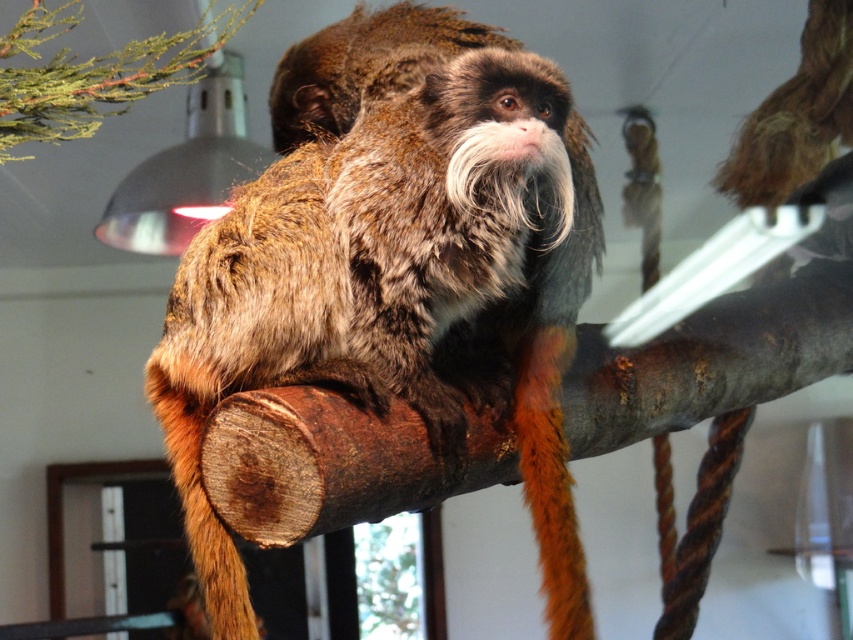
Question: Does brown furry monkey at center have a greater width compared to green leafy branch at upper left?

Choices:
 (A) no
 (B) yes

Answer: (B)

Question: Observing the image, what is the correct spatial positioning of brown furry monkey at center in reference to green leafy branch at upper left?

Choices:
 (A) left
 (B) right

Answer: (B)

Question: Which object appears closest to the camera in this image?

Choices:
 (A) green leafy branch at upper left
 (B) brown furry monkey at center

Answer: (B)

Question: Can you confirm if brown furry monkey at center is positioned to the right of green leafy branch at upper left?

Choices:
 (A) no
 (B) yes

Answer: (B)